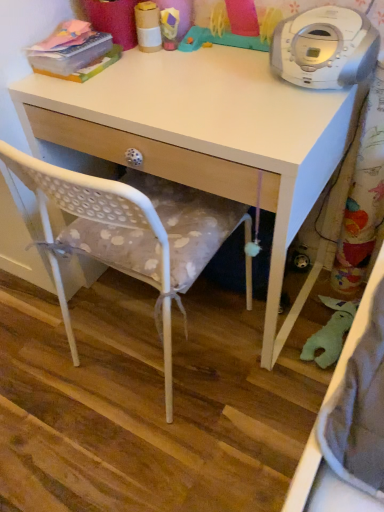
You are a GUI agent. You are given a task and a screenshot of the screen. Output one action in this format:
    pyautogui.click(x=<x>, y=<y>)
    Task: Click on the free space in front of white polka dot fabric chair at center
    This screenshot has height=512, width=384.
    Given the screenshot: What is the action you would take?
    pyautogui.click(x=166, y=445)